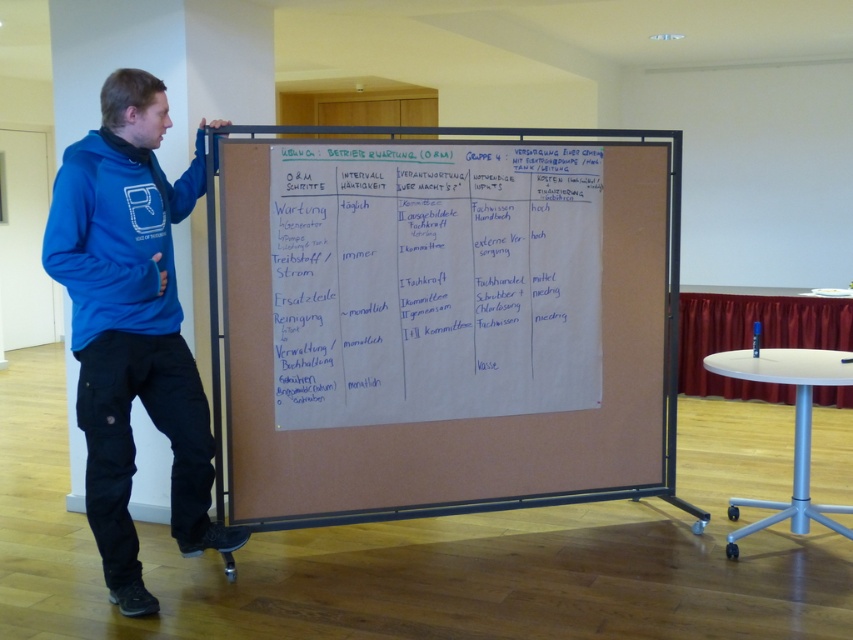
Who is taller, corkboard at center or blue cotton hoodie at left?

With more height is blue cotton hoodie at left.

Which of these two, corkboard at center or blue cotton hoodie at left, stands shorter?

corkboard at center is shorter.

Is point (560, 492) closer to viewer compared to point (138, 566)?

No, it is behind (138, 566).

At what (x,y) coordinates should I click in order to perform the action: click on corkboard at center. Please return your answer as a coordinate pair (x, y). This screenshot has width=853, height=640. Looking at the image, I should click on (444, 326).

Is corkboard at center to the right of blue fleece sweatshirt at left from the viewer's perspective?

Correct, you'll find corkboard at center to the right of blue fleece sweatshirt at left.

Is corkboard at center above blue fleece sweatshirt at left?

No.

Which is behind, point (498, 477) or point (137, 253)?

Point (498, 477)

Find the location of a particular element. corkboard at center is located at coordinates (444, 326).

Is point (109, 481) farther from camera compared to point (114, 209)?

That is True.

You are a GUI agent. You are given a task and a screenshot of the screen. Output one action in this format:
    pyautogui.click(x=<x>, y=<y>)
    Task: Click on the blue cotton hoodie at left
    
    Given the screenshot: What is the action you would take?
    pyautogui.click(x=132, y=324)

The image size is (853, 640). I want to click on blue cotton hoodie at left, so click(x=132, y=324).